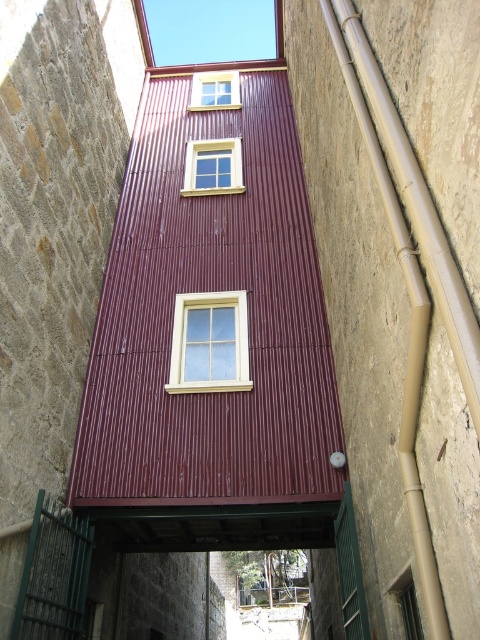
You are a window installer assessing the alleyway structure. You need to replace the white wood window at center and the matte yellow window at upper center. Which window should you replace first based on their vertical positions?

The white wood window at center should be replaced first because it is positioned under the matte yellow window at upper center, meaning it is lower and easier to access.

You are navigating through the alleyway and need to reach a specific location. There are two points marked in the scene. The first point is at coordinates point (188, 160) and the second point is at point (212, 74). Which point is closer to you as you stand at the entrance of the alleyway?

Point (188, 160) is in front of point (212, 74), so it is closer to you as you stand at the entrance of the alleyway.

You are standing in the alleyway and want to determine which of the two points, point [216,314] or point [207,97], is nearer to you. Based on the scene, which point is closer?

Point [216,314] is closer to the viewer than point [207,97].